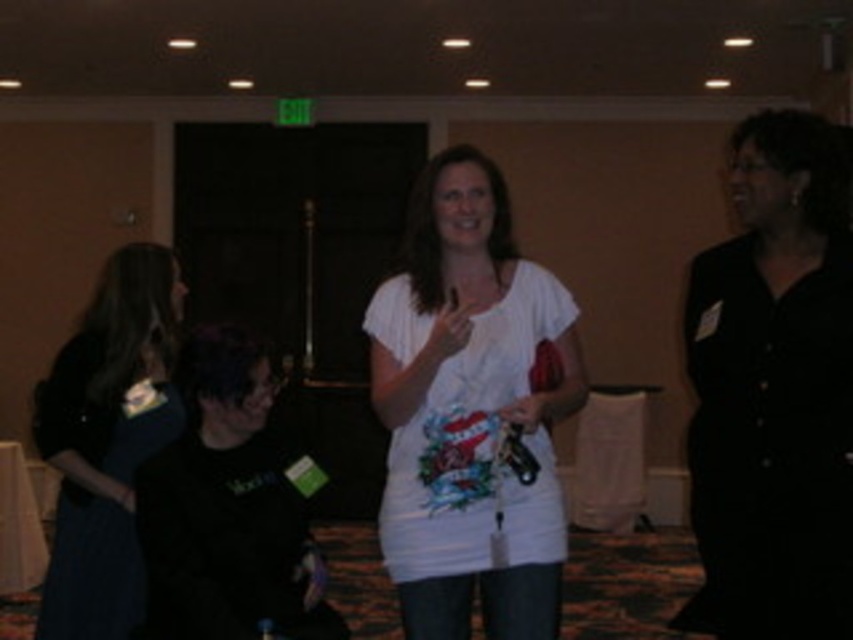
Who is shorter, black satin dress at right or white cotton t-shirt at center?

white cotton t-shirt at center

Which is below, black satin dress at right or white cotton t-shirt at center?

white cotton t-shirt at center

The image size is (853, 640). What are the coordinates of `black satin dress at right` in the screenshot? It's located at (775, 390).

Between point (757, 598) and point (57, 468), which one is positioned behind?

Point (57, 468)

Does black satin dress at right have a lesser width compared to dark blue dress at left?

Yes, black satin dress at right is thinner than dark blue dress at left.

Is point (827, 291) positioned before point (119, 260)?

Yes, point (827, 291) is closer to viewer.

Locate an element on the screen. This screenshot has width=853, height=640. black satin dress at right is located at coordinates (775, 390).

Is white cotton t-shirt at center thinner than dark blue dress at left?

In fact, white cotton t-shirt at center might be wider than dark blue dress at left.

Can you confirm if white cotton t-shirt at center is taller than dark blue dress at left?

Yes.

Find the location of a particular element. white cotton t-shirt at center is located at coordinates (469, 412).